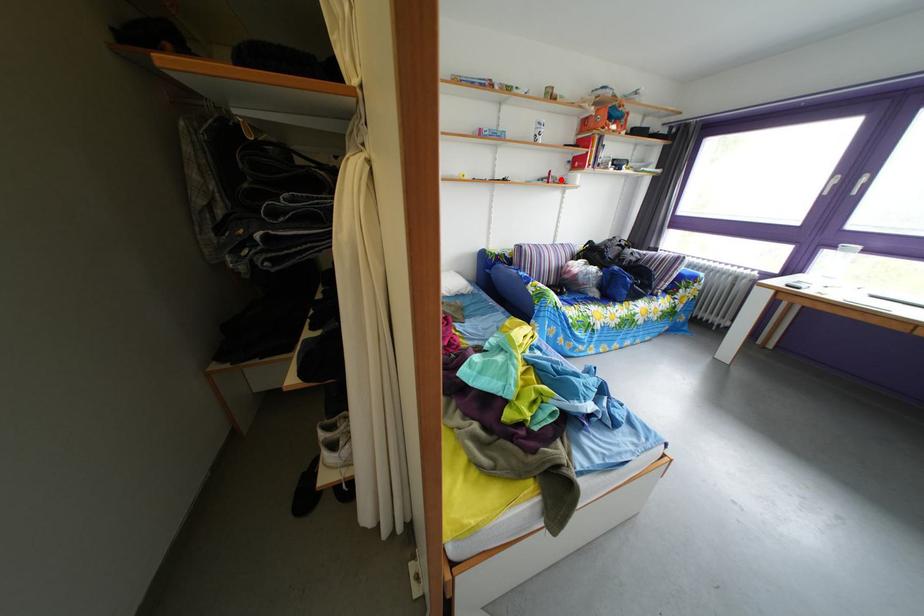
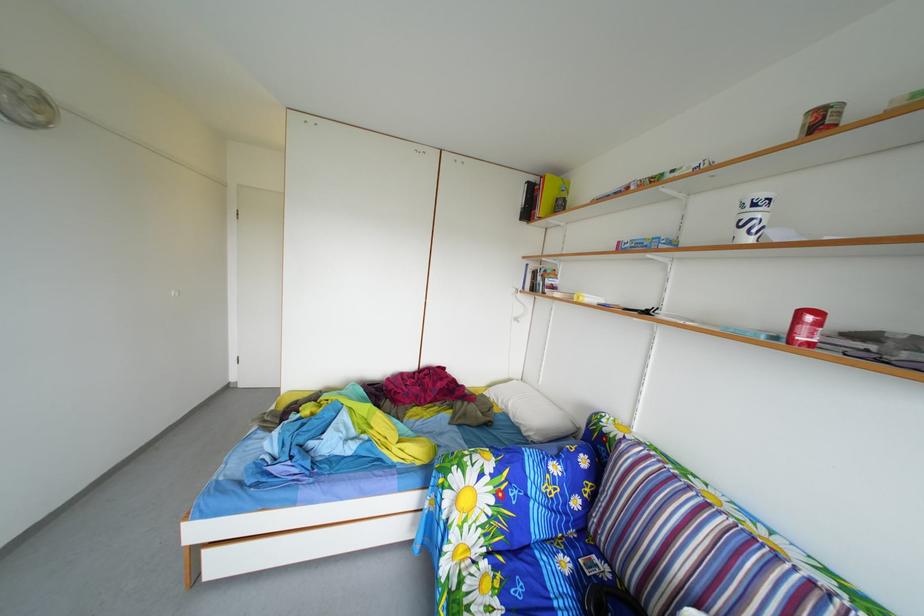
In the second image, find the point that corresponds to the highlighted location in the first image.

(811, 321)